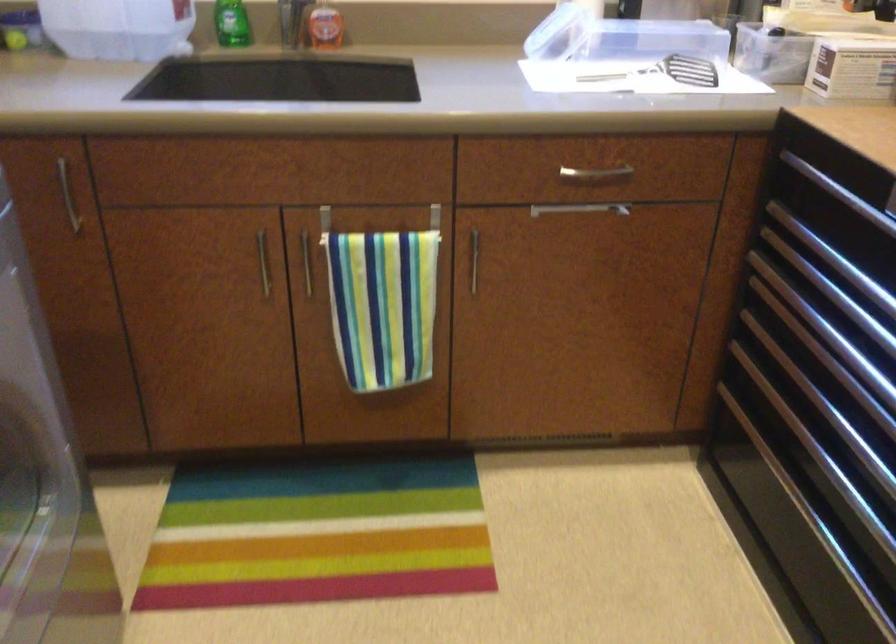
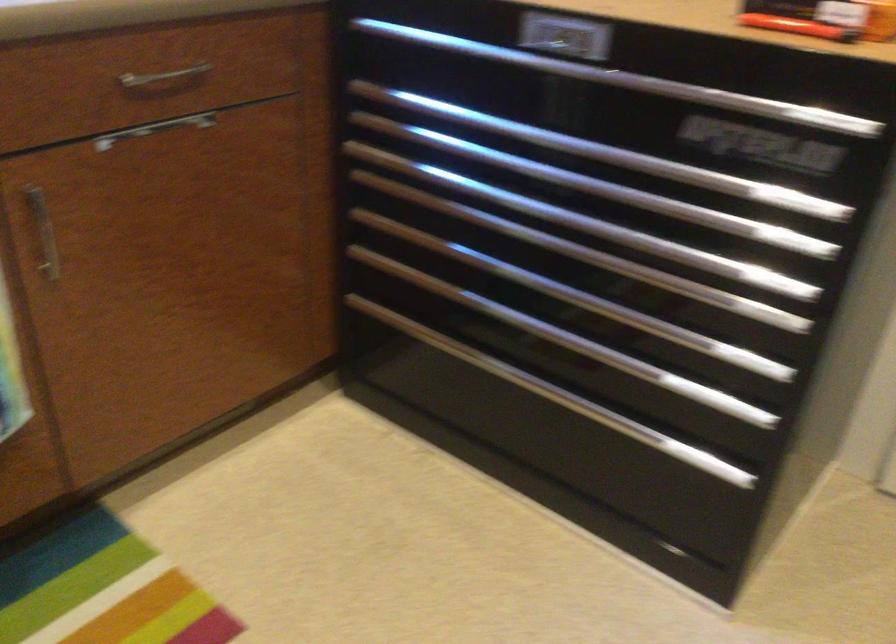
The point at [476,257] is marked in the first image. Where is the corresponding point in the second image?

(42, 232)